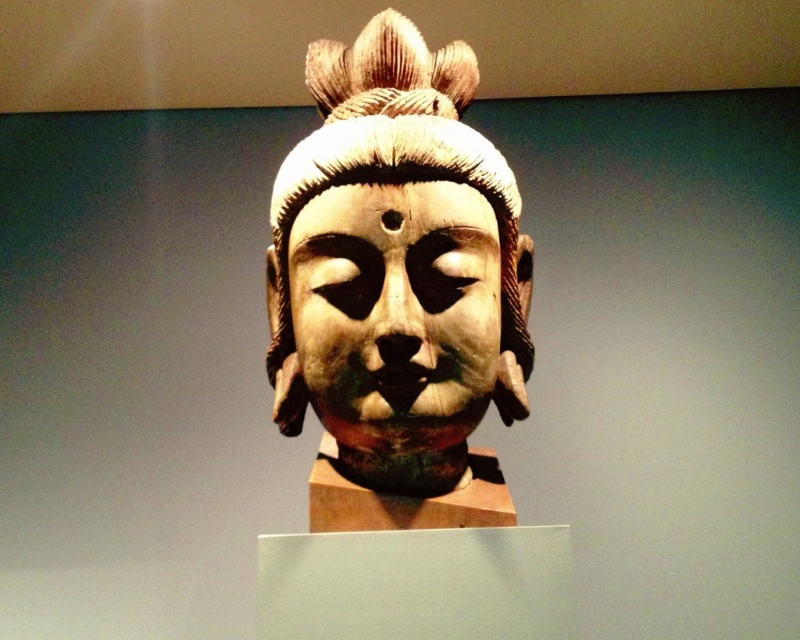
Is point (302, 362) positioned before point (425, 148)?

No.

Who is taller, matte wood mask at center or wooden textured headdress at center?

wooden textured headdress at center

Is point (470, 371) more distant than point (454, 145)?

No, it is in front of (454, 145).

This screenshot has width=800, height=640. Identify the location of matte wood mask at center. (393, 314).

Does point (392, 26) come in front of point (413, 412)?

That is False.

Can you confirm if wooden statue at center is positioned to the right of matte wood mask at center?

Indeed, wooden statue at center is positioned on the right side of matte wood mask at center.

Is point (402, 77) positioned behind point (476, 195)?

That is True.

At what (x,y) coordinates should I click in order to perform the action: click on wooden statue at center. Please return your answer as a coordinate pair (x, y). Image resolution: width=800 pixels, height=640 pixels. Looking at the image, I should click on (397, 285).

Between wooden statue at center and wooden textured headdress at center, which one has more height?

With more height is wooden statue at center.

Between wooden statue at center and wooden textured headdress at center, which one has less height?

Standing shorter between the two is wooden textured headdress at center.

Is point (426, 269) farther from viewer compared to point (328, 68)?

No, it is in front of (328, 68).

Identify the location of wooden statue at center. (397, 285).